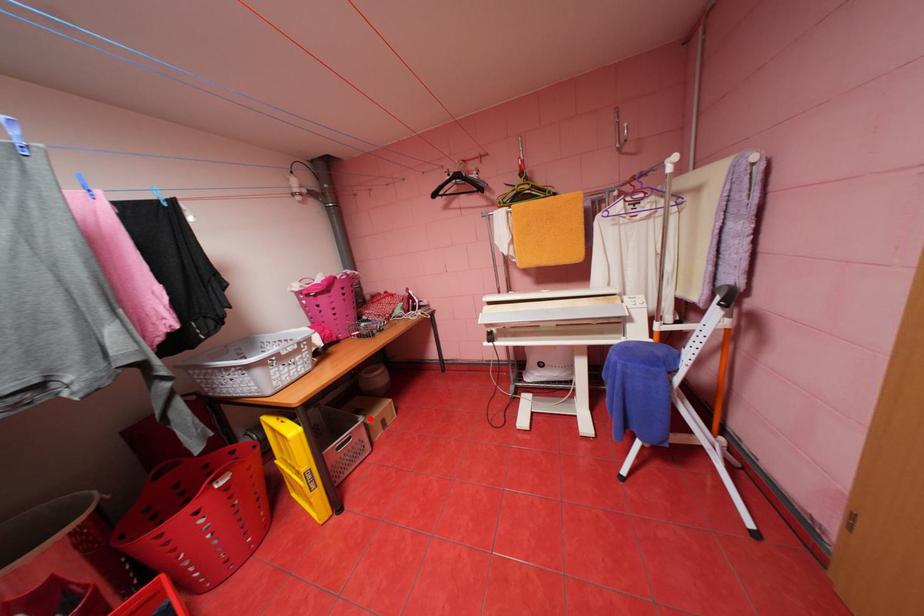
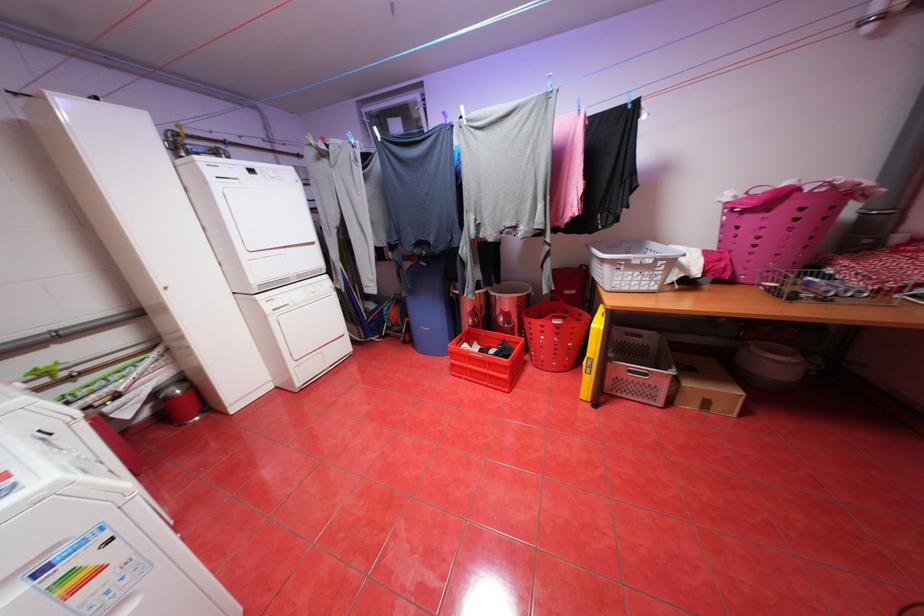
Find the pixel in the second image that matches the highlighted location in the first image.

(681, 371)